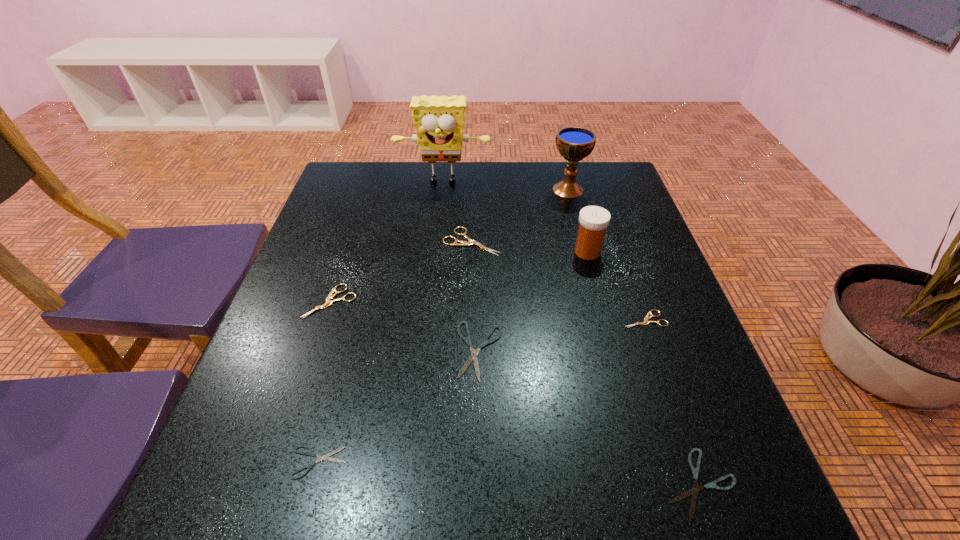
Identify which object is located as the eighth nearest to the shortest shears. Please provide its 2D coordinates. Your answer should be formatted as a tuple, i.e. [(x, y)], where the tuple contains the x and y coordinates of a point satisfying the conditions above.

[(574, 143)]

Identify which shears is the fifth nearest to the fifth shortest shears. Please provide its 2D coordinates. Your answer should be formatted as a tuple, i.e. [(x, y)], where the tuple contains the x and y coordinates of a point satisfying the conditions above.

[(694, 491)]

You are a GUI agent. You are given a task and a screenshot of the screen. Output one action in this format:
    pyautogui.click(x=<x>, y=<y>)
    Task: Click on the shears that is the third closest to the farthest shears
    The height and width of the screenshot is (540, 960).
    Given the screenshot: What is the action you would take?
    pyautogui.click(x=646, y=322)

Select which beige shears is the closest to the smallest beige shears. Please provide its 2D coordinates. Your answer should be formatted as a tuple, i.e. [(x, y)], where the tuple contains the x and y coordinates of a point satisfying the conditions above.

[(457, 242)]

At what (x,y) coordinates should I click in order to perform the action: click on the closest beige shears to the biggest black shears. Please return your answer as a coordinate pair (x, y). Looking at the image, I should click on (457, 242).

Locate an element on the screen. black shears that is the second closest to the second tallest shears is located at coordinates (311, 453).

Find the location of a particular element. This screenshot has width=960, height=540. the closest black shears to the biggest beige shears is located at coordinates click(473, 357).

The width and height of the screenshot is (960, 540). Identify the location of vacant area that satisfies the following two spatial constraints: 1. on the front side of the chalice; 2. on the left side of the rightmost beige shears. (602, 319).

The image size is (960, 540). I want to click on free space that satisfies the following two spatial constraints: 1. on the front-facing side of the white medicine; 2. on the left side of the sponge, so click(x=435, y=252).

Locate an element on the screen. The image size is (960, 540). blank area in the image that satisfies the following two spatial constraints: 1. on the front side of the second black shears from left to right; 2. on the left side of the second biggest black shears is located at coordinates (480, 483).